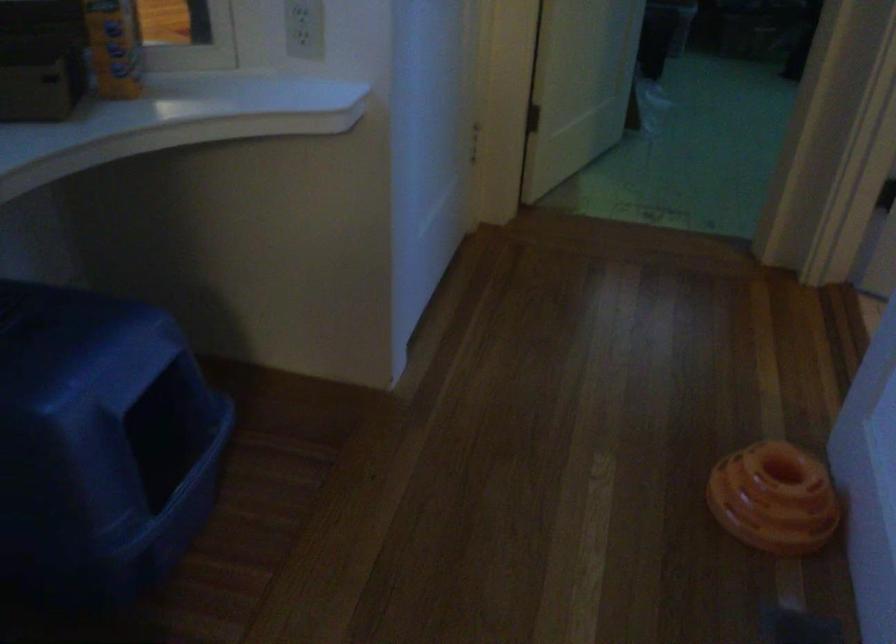
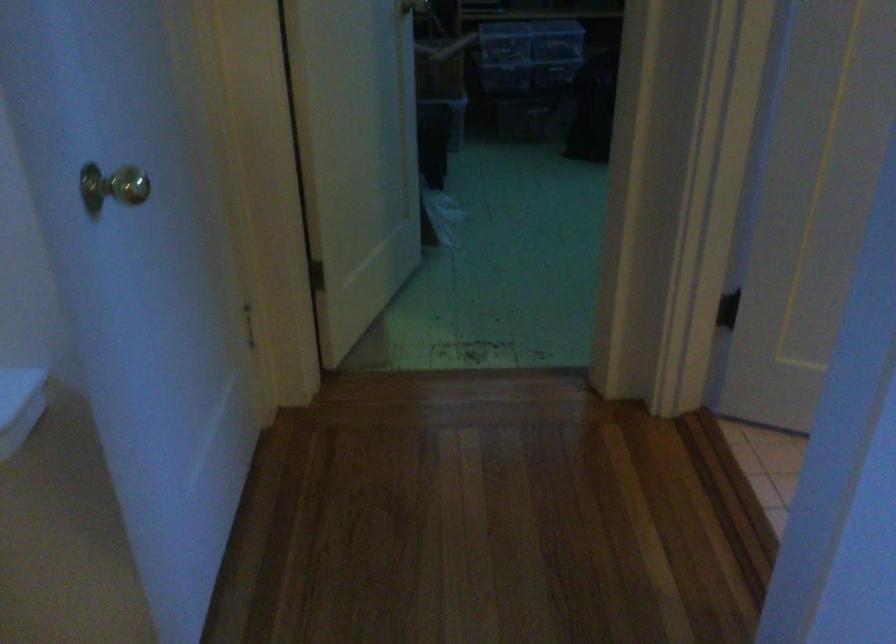
Question: The images are taken continuously from a first-person perspective. In which direction are you moving?

Choices:
 (A) Left
 (B) Right
 (C) Forward
 (D) Backward

Answer: (C)